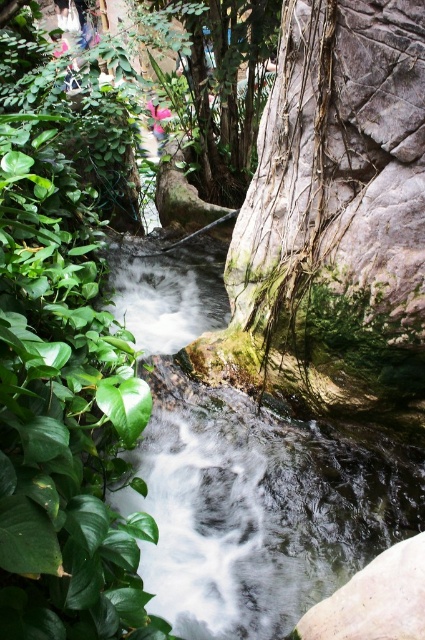
You are standing in the natural scene and want to pick the green leafy plant at left. Before reaching it, you must step over the white frothy water at center. Is the plant closer to you than the water?

The green leafy plant at left is closer to the viewer than the white frothy water at center, so yes, the plant is closer to you than the water.

You are a hiker who wants to cross the stream. You see the green leafy plant at left and the white frothy water at center. Which object is taller and can provide a better vantage point for observing the stream?

The white frothy water at center is taller than the green leafy plant at left, so it can provide a better vantage point for observing the stream.

You are standing in the scene and want to place a small decorative rock. You have two options for placement based on the coordinates given. Which point, point (39,616) or point (206,308), is closer to you where you are standing?

Point (39,616) is closer to the camera than point (206,308), so placing the rock there would be closer to your current position.